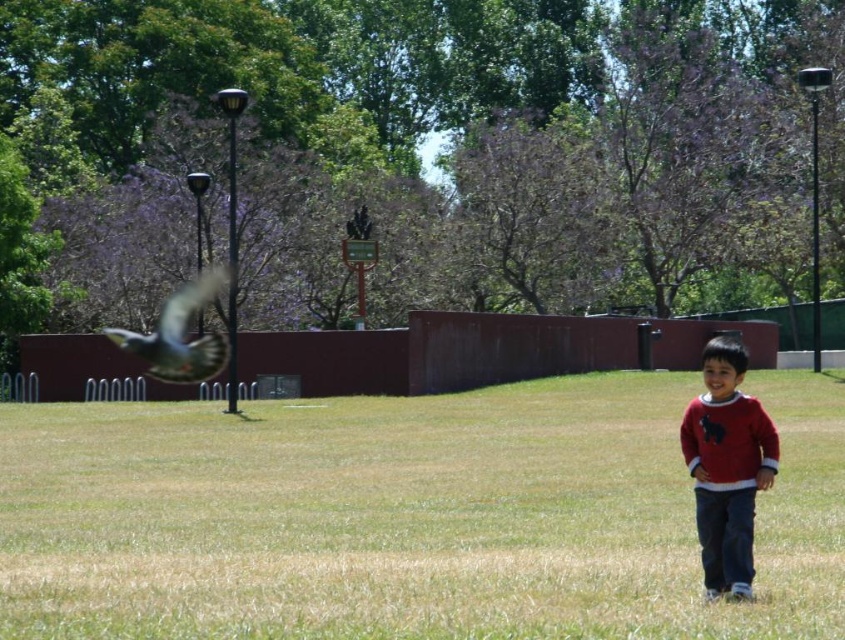
You are a photographer trying to capture the red cotton sweater at lower right and gray feathered bird at left in the same frame. Which object appears smaller in the image?

The red cotton sweater at lower right appears smaller in the image because it has a lesser height compared to the gray feathered bird at left.

You are a photographer trying to capture the gray feathered bird at left and the green grass at lower right in the same frame. Based on their positions, which object is more likely to be in the background?

The gray feathered bird at left is more likely to be in the background because it is positioned further away from the camera compared to the green grass at lower right.

You are a photographer trying to capture both the red cotton sweater at lower right and the gray feathered bird at left in the same frame. Given their distance apart, do you think you can fit both into your camera viewfinder without moving your position?

The red cotton sweater at lower right and the gray feathered bird at left are 50.09 feet apart from each other. Depending on the camera lens, a 50 feet distance might require a wide angle lens to capture both in the same frame without moving.